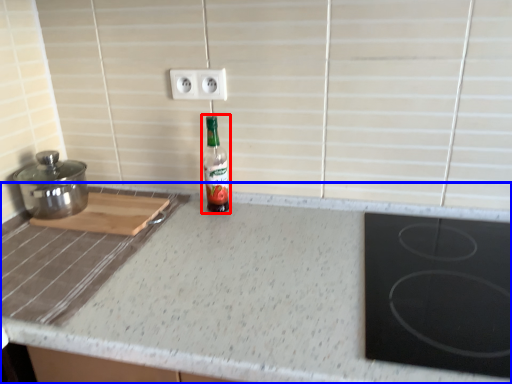
Question: Which point is closer to the camera, bottle (highlighted by a red box) or countertop (highlighted by a blue box)?

Choices:
 (A) bottle
 (B) countertop

Answer: (B)